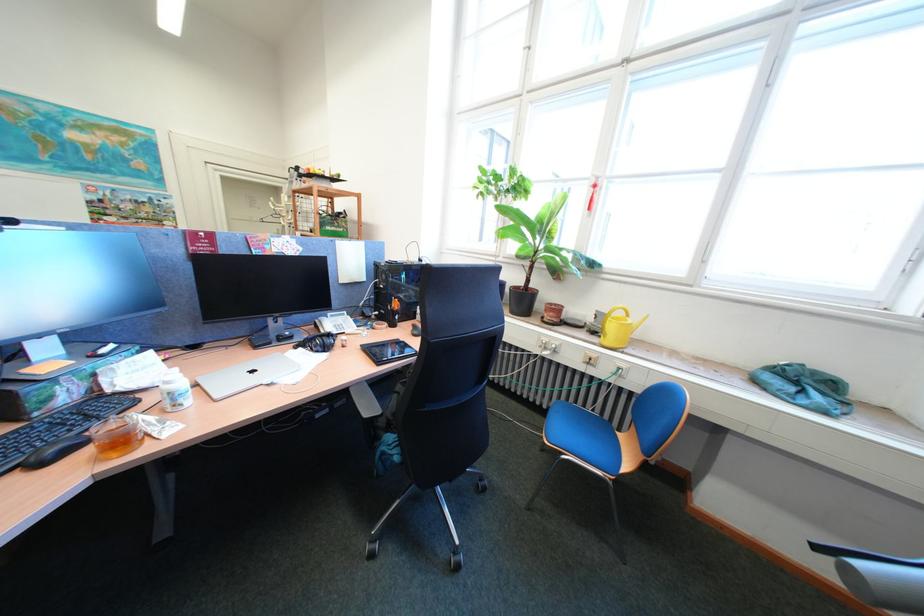
Locate an element on the screen. silver laptop is located at coordinates (246, 376).